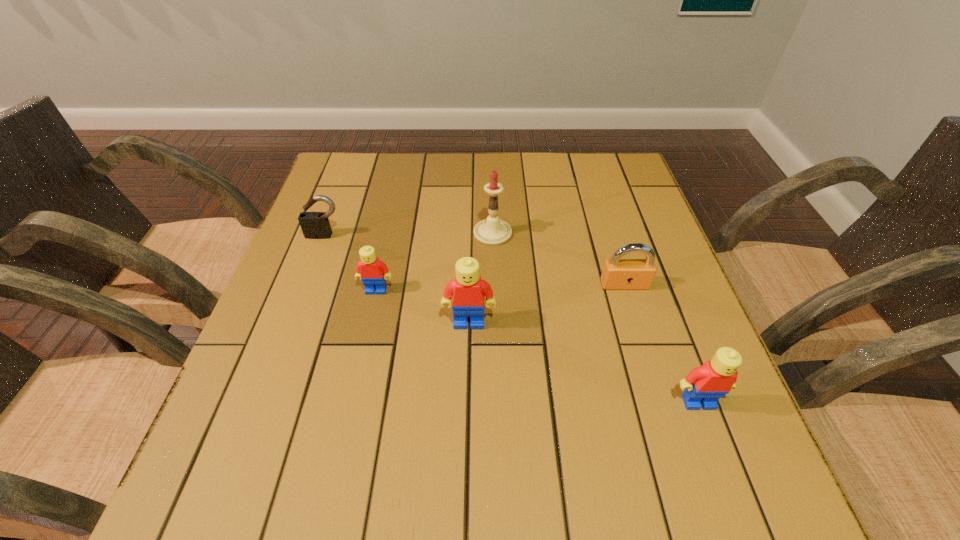
Find the location of a particular element. The height and width of the screenshot is (540, 960). the second object from left to right is located at coordinates (370, 269).

Identify the location of the farthest Lego. This screenshot has width=960, height=540. (370, 269).

You are a GUI agent. You are given a task and a screenshot of the screen. Output one action in this format:
    pyautogui.click(x=<x>, y=<y>)
    Task: Click on the fifth farthest object
    The height and width of the screenshot is (540, 960).
    Given the screenshot: What is the action you would take?
    pyautogui.click(x=468, y=291)

The height and width of the screenshot is (540, 960). Find the location of `the second Lego from right to left`. the second Lego from right to left is located at coordinates (468, 291).

This screenshot has height=540, width=960. In order to click on the third tallest object in this screenshot , I will do `click(704, 385)`.

Find the location of `the second tallest Lego`. the second tallest Lego is located at coordinates (704, 385).

Locate an element on the screen. the nearer padlock is located at coordinates point(617,273).

You are a GUI agent. You are given a task and a screenshot of the screen. Output one action in this format:
    pyautogui.click(x=<x>, y=<y>)
    Task: Click on the candle
    This screenshot has height=540, width=960.
    Given the screenshot: What is the action you would take?
    pyautogui.click(x=492, y=231)

What are the coordinates of `the farther padlock` in the screenshot? It's located at (315, 225).

I want to click on the leftmost object, so (x=315, y=225).